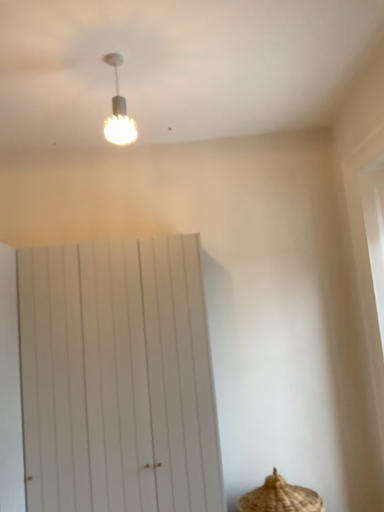
Question: Is white textured bulb at upper center closer to the viewer compared to white wooden barn door at center?

Choices:
 (A) no
 (B) yes

Answer: (B)

Question: Is white textured bulb at upper center placed right next to white wooden barn door at center?

Choices:
 (A) no
 (B) yes

Answer: (A)

Question: Would you consider white textured bulb at upper center to be distant from white wooden barn door at center?

Choices:
 (A) no
 (B) yes

Answer: (B)

Question: Can you confirm if white textured bulb at upper center is wider than white wooden barn door at center?

Choices:
 (A) yes
 (B) no

Answer: (B)

Question: From the image's perspective, is white textured bulb at upper center located above white wooden barn door at center?

Choices:
 (A) yes
 (B) no

Answer: (A)

Question: From their relative heights in the image, would you say white wooden barn door at center is taller or shorter than brown woven basket at lower right?

Choices:
 (A) short
 (B) tall

Answer: (B)

Question: From a real-world perspective, is white wooden barn door at center physically located above or below brown woven basket at lower right?

Choices:
 (A) below
 (B) above

Answer: (B)

Question: Which is correct: white wooden barn door at center is inside brown woven basket at lower right, or outside of it?

Choices:
 (A) inside
 (B) outside

Answer: (B)

Question: Looking at their shapes, would you say white wooden barn door at center is wider or thinner than brown woven basket at lower right?

Choices:
 (A) wide
 (B) thin

Answer: (B)

Question: From a real-world perspective, is white wooden barn door at center physically located above or below white textured bulb at upper center?

Choices:
 (A) above
 (B) below

Answer: (B)

Question: Is white wooden barn door at center taller or shorter than white textured bulb at upper center?

Choices:
 (A) tall
 (B) short

Answer: (A)

Question: Considering the positions of white wooden barn door at center and white textured bulb at upper center in the image, is white wooden barn door at center wider or thinner than white textured bulb at upper center?

Choices:
 (A) thin
 (B) wide

Answer: (B)

Question: Is point (52, 321) positioned closer to the camera than point (117, 101)?

Choices:
 (A) farther
 (B) closer

Answer: (A)

Question: Looking at their shapes, would you say white textured bulb at upper center is wider or thinner than white wooden barn door at center?

Choices:
 (A) wide
 (B) thin

Answer: (B)

Question: Choose the correct answer: Is white textured bulb at upper center inside white wooden barn door at center or outside it?

Choices:
 (A) inside
 (B) outside

Answer: (B)